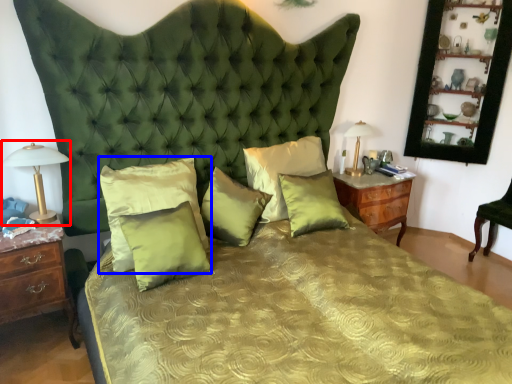
Question: Among these objects, which one is farthest to the camera, bedside lamp (highlighted by a red box) or pillow (highlighted by a blue box)?

Choices:
 (A) bedside lamp
 (B) pillow

Answer: (B)